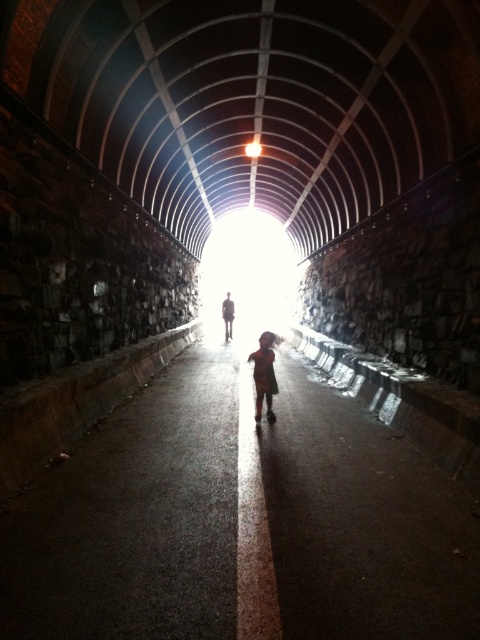
Question: Is silhouette figure at center above bright white light at center?

Choices:
 (A) yes
 (B) no

Answer: (B)

Question: Among these points, which one is farthest from the camera?

Choices:
 (A) (250, 141)
 (B) (230, 305)

Answer: (B)

Question: Among these points, which one is farthest from the camera?

Choices:
 (A) (248, 144)
 (B) (261, 356)

Answer: (A)

Question: Which point appears closest to the camera in this image?

Choices:
 (A) (227, 323)
 (B) (264, 365)

Answer: (B)

Question: Is dark brown fabric child at center bigger than silhouette figure at center?

Choices:
 (A) yes
 (B) no

Answer: (A)

Question: Is silhouette figure at center below bright white light at center?

Choices:
 (A) no
 (B) yes

Answer: (B)